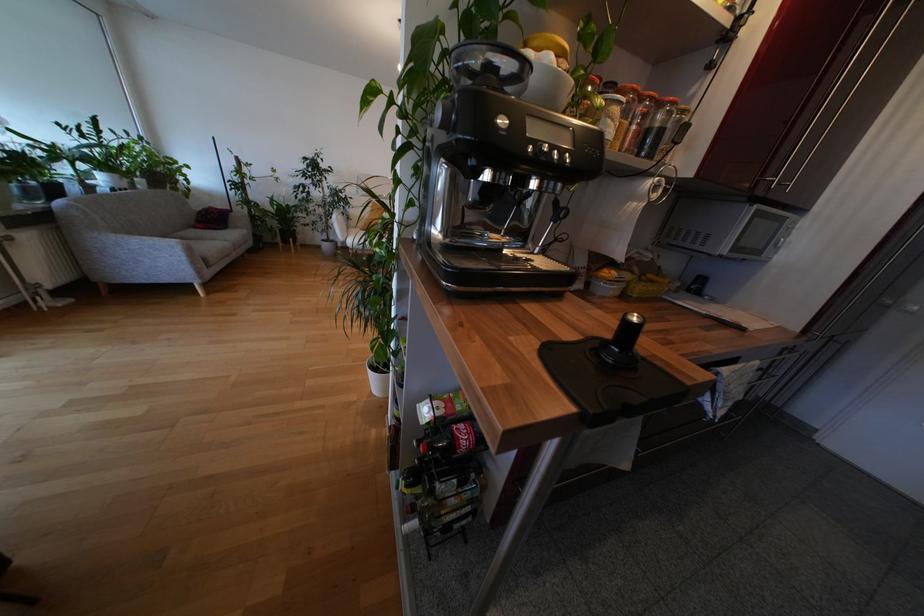
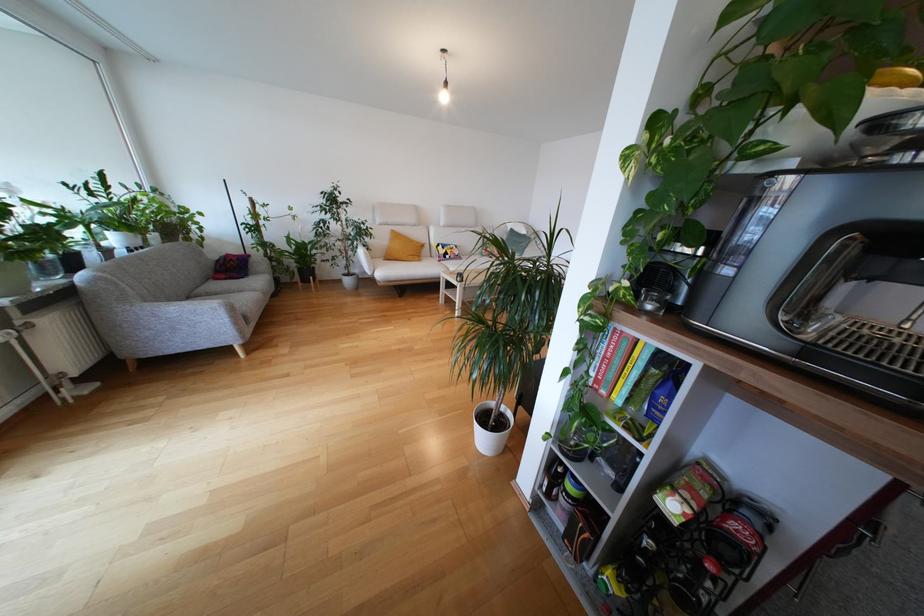
In the second image, find the point that corresponds to [234,223] in the first image.

(253, 268)